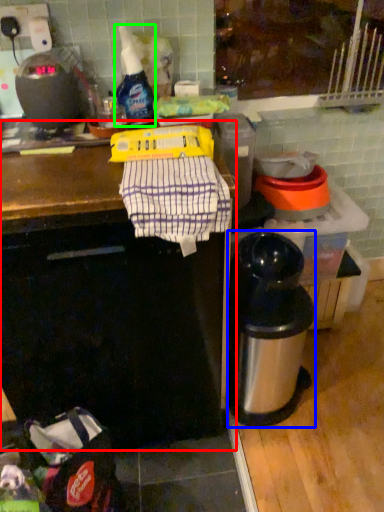
Question: Which object is the farthest from counter (highlighted by a red box)? Choose among these: appliance (highlighted by a blue box) or bottle (highlighted by a green box).

Choices:
 (A) appliance
 (B) bottle

Answer: (B)